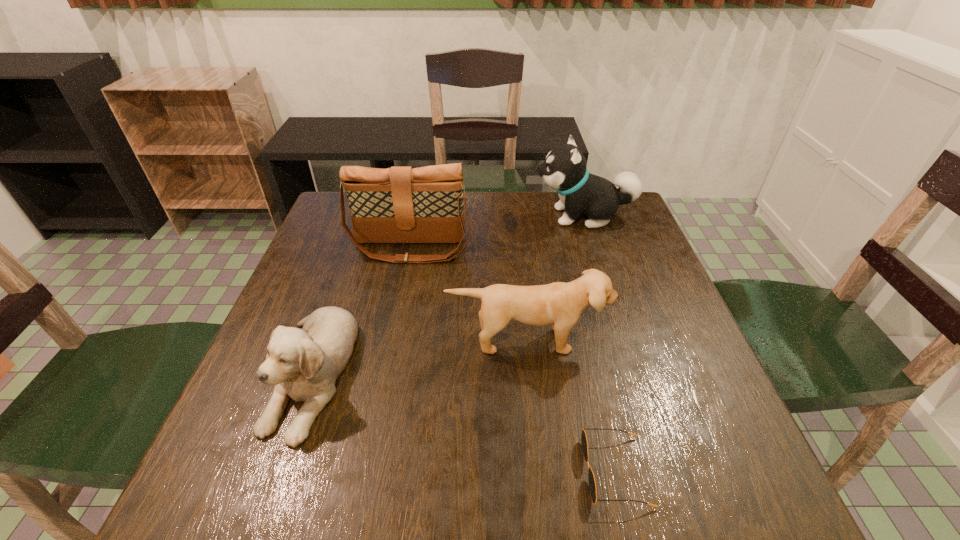
Identify the location of vacant space that's between the leftmost puppy and the shoulder bag. The height and width of the screenshot is (540, 960). pyautogui.click(x=361, y=310).

Locate an element on the screen. Image resolution: width=960 pixels, height=540 pixels. unoccupied position between the tallest puppy and the second farthest object is located at coordinates (497, 232).

Locate an element on the screen. The height and width of the screenshot is (540, 960). vacant space in between the leftmost puppy and the fourth nearest object is located at coordinates (361, 310).

You are a GUI agent. You are given a task and a screenshot of the screen. Output one action in this format:
    pyautogui.click(x=<x>, y=<y>)
    Task: Click on the third closest object to the leftmost puppy
    The width and height of the screenshot is (960, 540).
    Given the screenshot: What is the action you would take?
    pyautogui.click(x=592, y=485)

Find the location of a particular element. The image size is (960, 540). object that ranks as the second closest to the shoulder bag is located at coordinates (565, 170).

Locate an element on the screen. Image resolution: width=960 pixels, height=540 pixels. puppy that is the third closest to the shoulder bag is located at coordinates (560, 304).

The height and width of the screenshot is (540, 960). Identify the location of puppy identified as the third closest to the fourth nearest object. (560, 304).

Identify the location of free location that satisfies the following two spatial constraints: 1. at the face of the farthest puppy; 2. on the front-facing side of the fourth nearest object. Image resolution: width=960 pixels, height=540 pixels. (594, 248).

The image size is (960, 540). What are the coordinates of `free spot that satisfies the following two spatial constraints: 1. at the face of the farthest object; 2. on the front-facing side of the leftmost puppy` in the screenshot? It's located at (634, 373).

Identify the location of vacant space that satisfies the following two spatial constraints: 1. at the face of the farthest puppy; 2. on the front-facing side of the second farthest object. This screenshot has width=960, height=540. (594, 248).